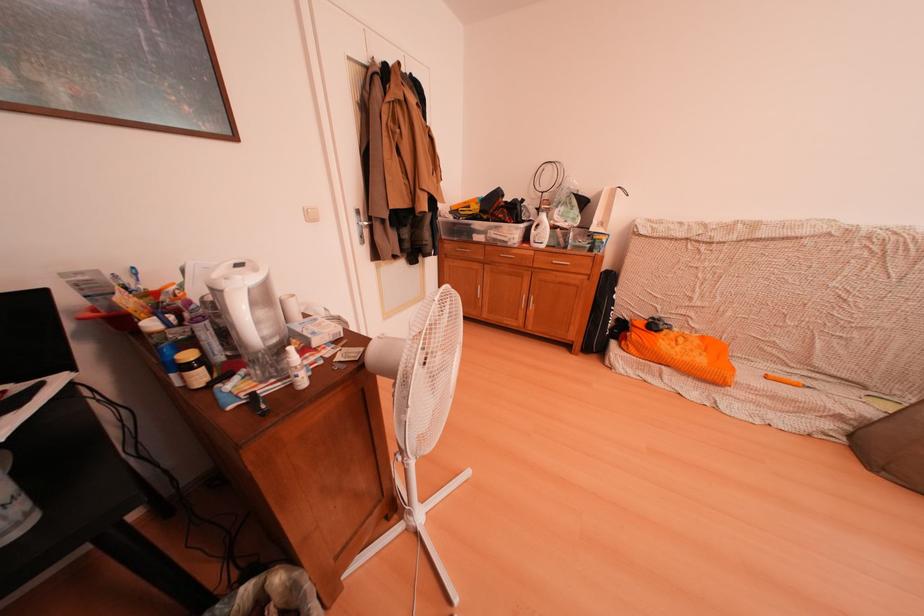
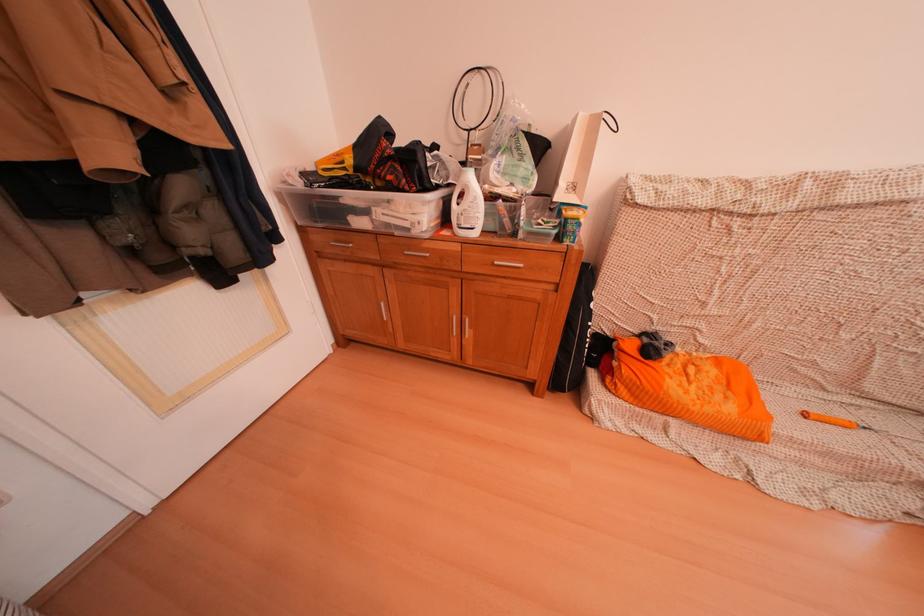
Where in the second image is the point corresponding to (x=784, y=379) from the first image?

(824, 415)